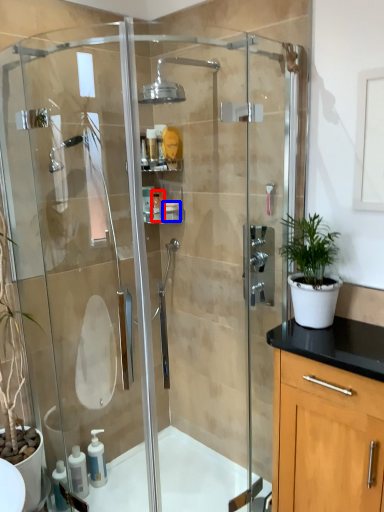
Question: Which object appears closest to the camera in this image, toiletry (highlighted by a red box) or toiletry (highlighted by a blue box)?

Choices:
 (A) toiletry
 (B) toiletry

Answer: (B)